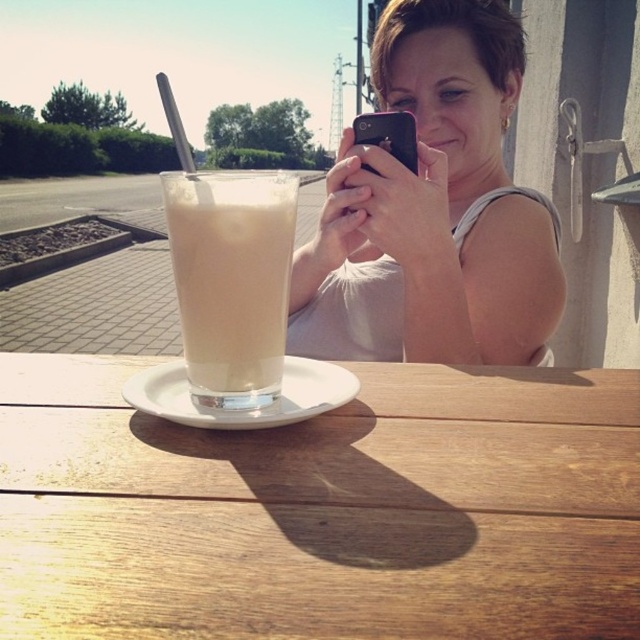
In order to click on wooden table at center in this screenshot , I will do `click(323, 509)`.

Does wooden table at center appear on the right side of black matte smartphone at center?

Incorrect, wooden table at center is not on the right side of black matte smartphone at center.

Is point (349, 420) closer to viewer compared to point (355, 131)?

Yes.

At what (x,y) coordinates should I click in order to perform the action: click on wooden table at center. Please return your answer as a coordinate pair (x, y). The height and width of the screenshot is (640, 640). Looking at the image, I should click on (323, 509).

Is point (515, 196) positioned after point (387, 140)?

Yes, it is.

Is matte white tank top at upper center above black matte smartphone at center?

Incorrect, matte white tank top at upper center is not positioned above black matte smartphone at center.

In order to click on matte white tank top at upper center in this screenshot , I will do `click(433, 209)`.

Locate an element on the screen. The height and width of the screenshot is (640, 640). matte white tank top at upper center is located at coordinates (433, 209).

Does matte white tank top at upper center have a lesser width compared to white ceramic saucer at center?

No.

Does matte white tank top at upper center appear over white ceramic saucer at center?

Correct, matte white tank top at upper center is located above white ceramic saucer at center.

Between point (426, 172) and point (172, 412), which one is positioned behind?

Point (426, 172)

Find the location of `matte white tank top at upper center`. matte white tank top at upper center is located at coordinates (433, 209).